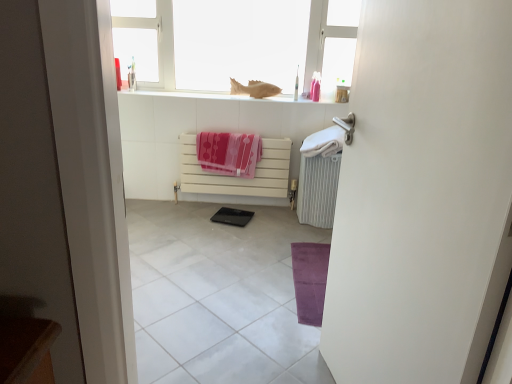
Question: Could you tell me if white soft towel at right, the first beach towel viewed from the right, is turned towards white glossy tile at center?

Choices:
 (A) yes
 (B) no

Answer: (B)

Question: Are white soft towel at right, arranged as the second beach towel when viewed from the left, and white glossy tile at center far apart?

Choices:
 (A) no
 (B) yes

Answer: (A)

Question: Is white soft towel at right, arranged as the second beach towel when viewed from the left, at the right side of white glossy tile at center?

Choices:
 (A) no
 (B) yes

Answer: (B)

Question: From the image's perspective, is white soft towel at right, the first beach towel viewed from the right, above white glossy tile at center?

Choices:
 (A) yes
 (B) no

Answer: (A)

Question: Does white soft towel at right, the first beach towel viewed from the right, have a larger size compared to white glossy tile at center?

Choices:
 (A) no
 (B) yes

Answer: (A)

Question: From the image's perspective, is white soft towel at right, the first beach towel viewed from the right, located beneath white glossy tile at center?

Choices:
 (A) yes
 (B) no

Answer: (B)

Question: Is white matte door at right positioned far away from white matte radiator at center?

Choices:
 (A) yes
 (B) no

Answer: (A)

Question: Is the depth of white matte door at right less than that of white matte radiator at center?

Choices:
 (A) no
 (B) yes

Answer: (B)

Question: Does white matte door at right lie behind white matte radiator at center?

Choices:
 (A) yes
 (B) no

Answer: (B)

Question: Can you confirm if white matte door at right is positioned to the left of white matte radiator at center?

Choices:
 (A) no
 (B) yes

Answer: (A)

Question: From the image's perspective, does white matte door at right appear lower than white matte radiator at center?

Choices:
 (A) no
 (B) yes

Answer: (B)

Question: Is white matte door at right oriented away from white matte radiator at center?

Choices:
 (A) no
 (B) yes

Answer: (A)

Question: Does white matte radiator at center appear on the right side of black glossy pad at center?

Choices:
 (A) yes
 (B) no

Answer: (A)